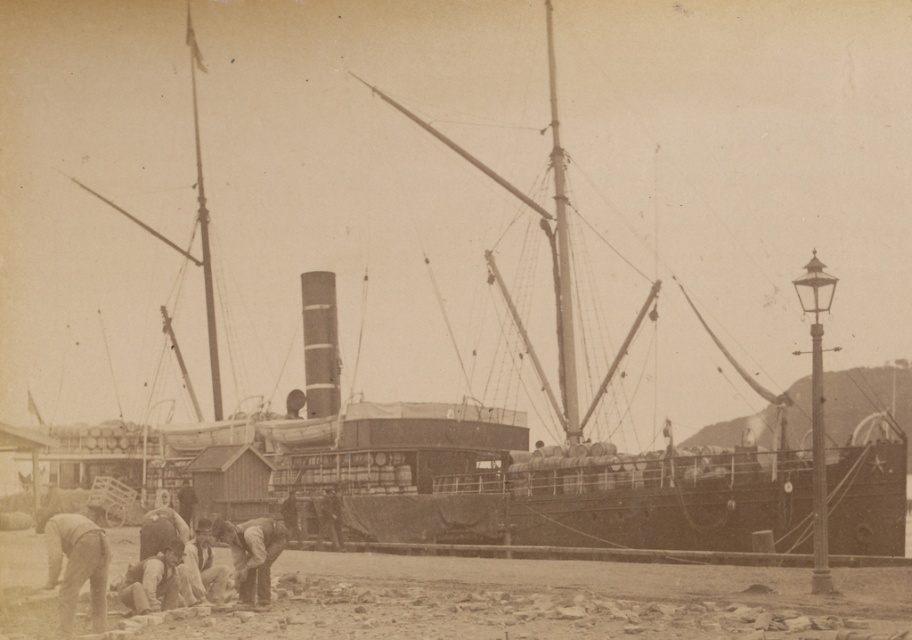
Question: Considering the real-world distances, which object is closest to the smooth wood mast at center?

Choices:
 (A) smooth wood mast at upper left
 (B) smooth beige pants at lower left
 (C) brown leather boots at lower center
 (D) light brown leather boots at lower left

Answer: (A)

Question: Is smooth wood mast at upper left smaller than light brown leather boots at lower left?

Choices:
 (A) no
 (B) yes

Answer: (A)

Question: Can you confirm if brown leather boots at lower center is positioned to the left of smooth wood mast at upper left?

Choices:
 (A) yes
 (B) no

Answer: (B)

Question: Which point is closer to the camera?

Choices:
 (A) (264, 560)
 (B) (90, 557)

Answer: (B)

Question: Is brown leather boots at lower center thinner than smooth wood mast at upper left?

Choices:
 (A) no
 (B) yes

Answer: (B)

Question: Among these objects, which one is farthest from the camera?

Choices:
 (A) smooth beige pants at lower left
 (B) smooth wood mast at upper left

Answer: (B)